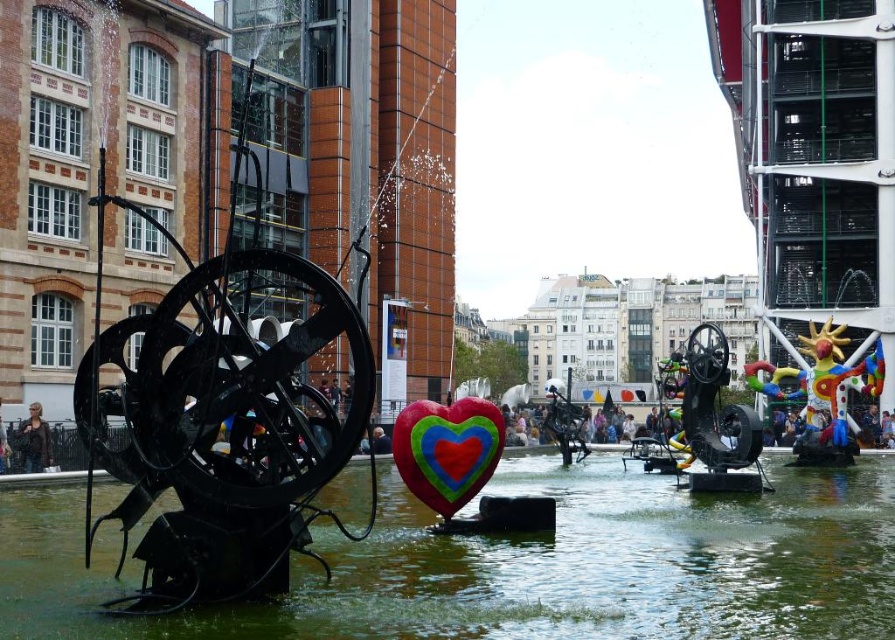
Question: Does matte black jacket at left appear on the right side of smooth skin person at center?

Choices:
 (A) no
 (B) yes

Answer: (A)

Question: Which point is farther to the camera?

Choices:
 (A) matte black jacket at left
 (B) smooth skin person at center
 (C) green metallic water at center

Answer: (A)

Question: Estimate the real-world distances between objects in this image. Which object is farther from the matte black jacket at left?

Choices:
 (A) multicolored fabric heart at center
 (B) green metallic water at center

Answer: (B)

Question: Does green metallic water at center appear under smooth skin person at center?

Choices:
 (A) no
 (B) yes

Answer: (B)

Question: Can you confirm if matte black jacket at left is thinner than smooth skin person at center?

Choices:
 (A) no
 (B) yes

Answer: (B)

Question: Estimate the real-world distances between objects in this image. Which object is closer to the green metallic water at center?

Choices:
 (A) smooth skin person at center
 (B) multicolored fabric heart at center

Answer: (B)